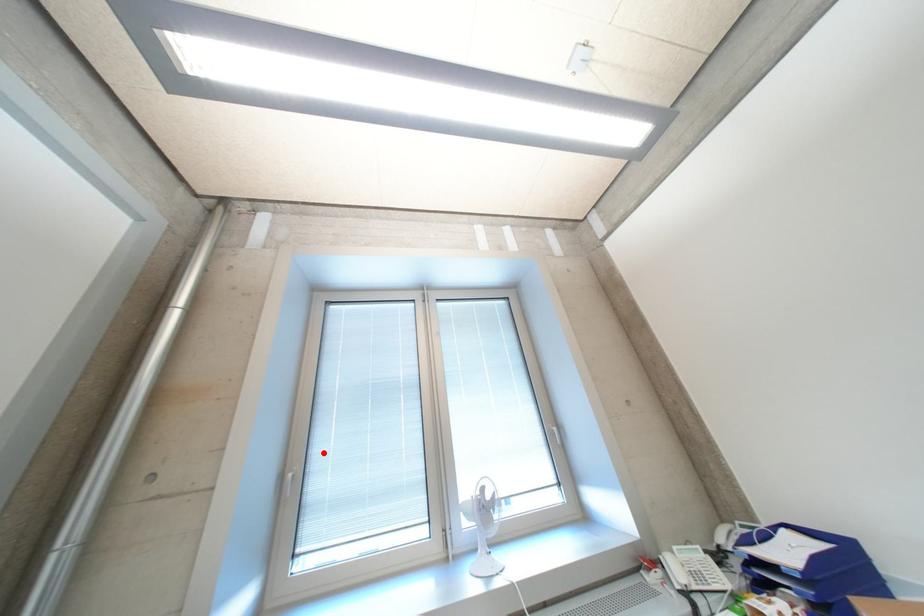
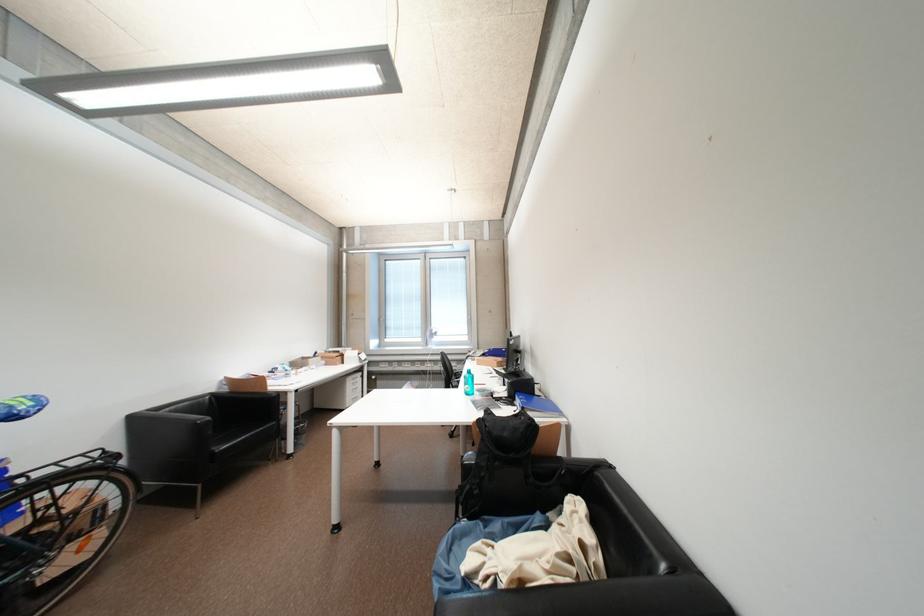
Where in the second image is the point corresponding to the highlighted location from the first image?

(395, 315)